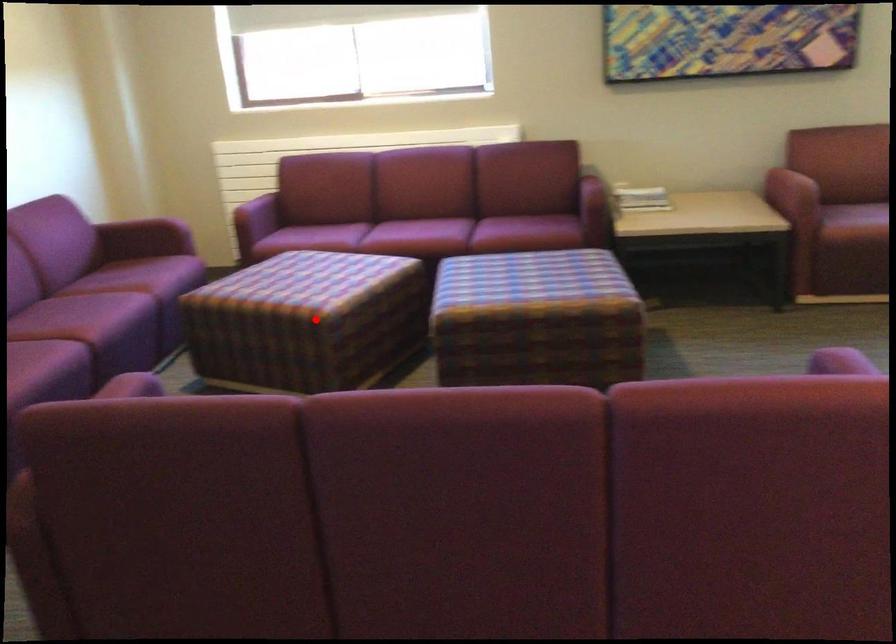
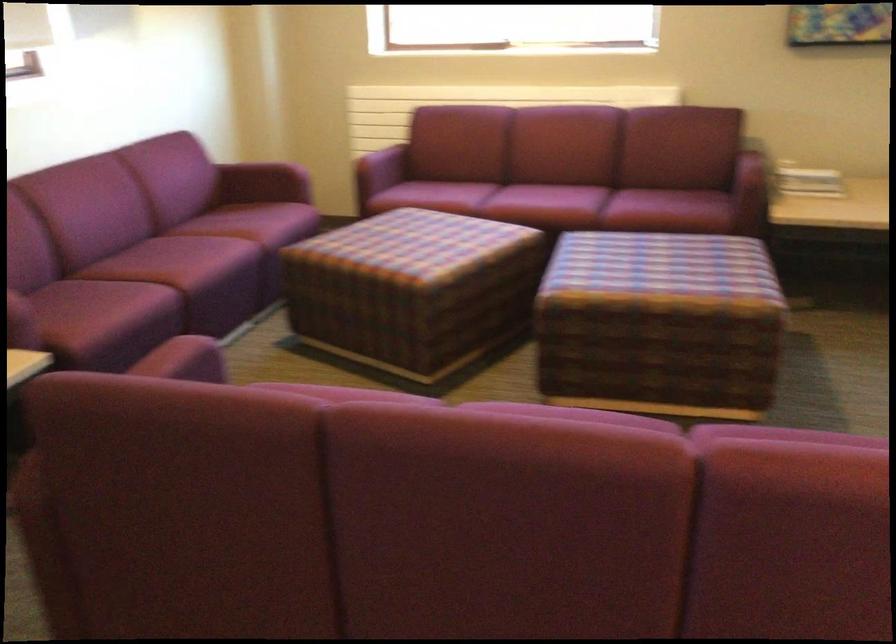
The point at the highlighted location is marked in the first image. Where is the corresponding point in the second image?

(412, 289)